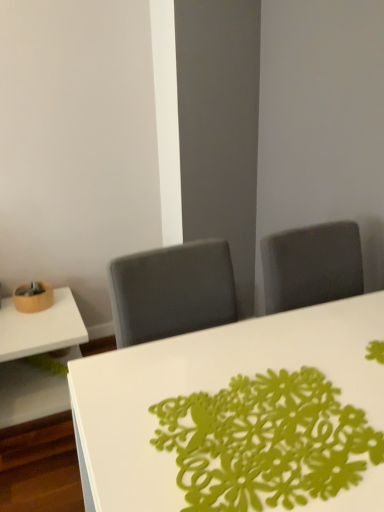
Question: Do you think white glossy table at lower left, the first table positioned from the left, is within green paper doily at center, or outside of it?

Choices:
 (A) inside
 (B) outside

Answer: (B)

Question: Is white glossy table at lower left, the first table positioned from the left, wider or thinner than green paper doily at center?

Choices:
 (A) thin
 (B) wide

Answer: (B)

Question: Which object is positioned farthest from the white glossy table at center, positioned as the 2th table in left-to-right order?

Choices:
 (A) green paper doily at center
 (B) white glossy table at lower left, the second table viewed from the front

Answer: (B)

Question: Estimate the real-world distances between objects in this image. Which object is farther from the white glossy table at center, acting as the 1th table starting from the right?

Choices:
 (A) white glossy table at lower left, the second table viewed from the front
 (B) green paper doily at center

Answer: (A)